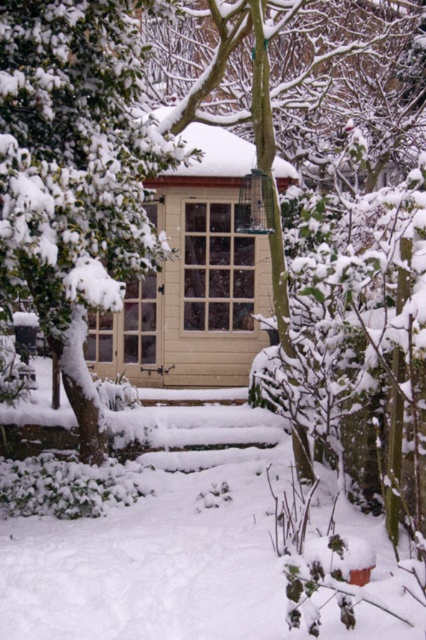
You are an observer standing in front of the wooden window at center. Looking towards the green textured tree at left, can you determine if the tree is wider than the window?

The green textured tree at left might be wider than wooden window at center, so it is possible that the tree is wider than the window.

From the picture: You are standing in front of the wooden structure and notice the green textured tree at left and the wooden window at center. Which object appears taller from your perspective?

The green textured tree at left appears taller than the wooden window at center because it has a greater height compared to the wooden window at center according to the description.

You are standing at the center of the snowy area in the winter scene. Looking around, you see the green textured tree at left represented by point [74,173]. Which direction should you walk to reach the green textured tree at left?

The green textured tree at left is located at point [74,173], which is to the left side of the scene. Therefore, you should walk towards the left direction to reach the green textured tree at left.